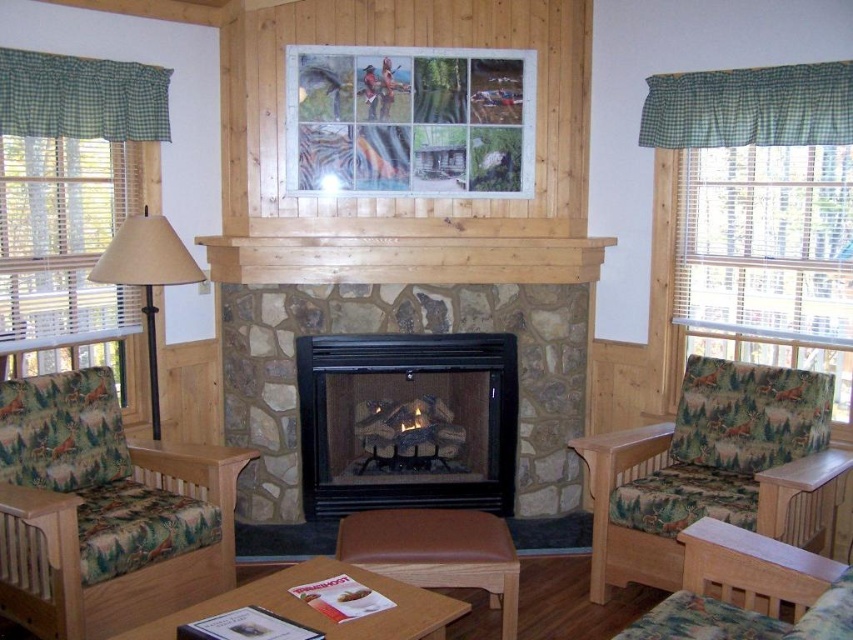
You are sitting on the floor in the living room and want to place a small decorative item on the higher object between the patterned fabric couch at right and the beige fabric lampshade at left. Which object should you choose?

The beige fabric lampshade at left is taller than the patterned fabric couch at right, so you should place the decorative item on the beige fabric lampshade at left.